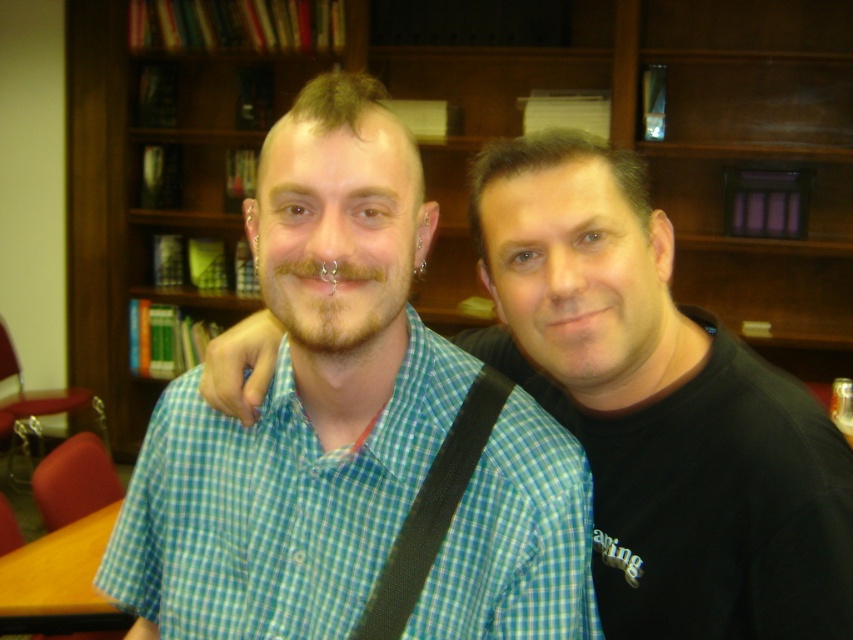
You are standing in a library and see two points marked in the image. The first point is at coordinate (76, 259) and the second is at (474, 404). Which point is closer to you?

Point (76, 259) is further to the camera than point (474, 404), so the second point is closer to you.

You are standing in a library and want to reach a book located at point (144,241). If your arm can extend 3 feet, can you reach the book without moving?

The distance between you and the book at point (144,241) is 13.93 feet, which is much farther than your 3 feet arm extension. You cannot reach the book without moving.

You are a photographer standing in front of the two people in the image. You want to take a photo of both individuals so that the blue checkered shirt at center and brownhairbeard at center are clearly visible. Which person should be placed to the left in the frame to ensure both are fully visible?

The brownhairbeard at center should be placed to the left in the frame. Since the blue checkered shirt at center is positioned on the right side of brownhairbeard at center, positioning brownhairbeard at center to the left ensures both are fully visible in the photo.